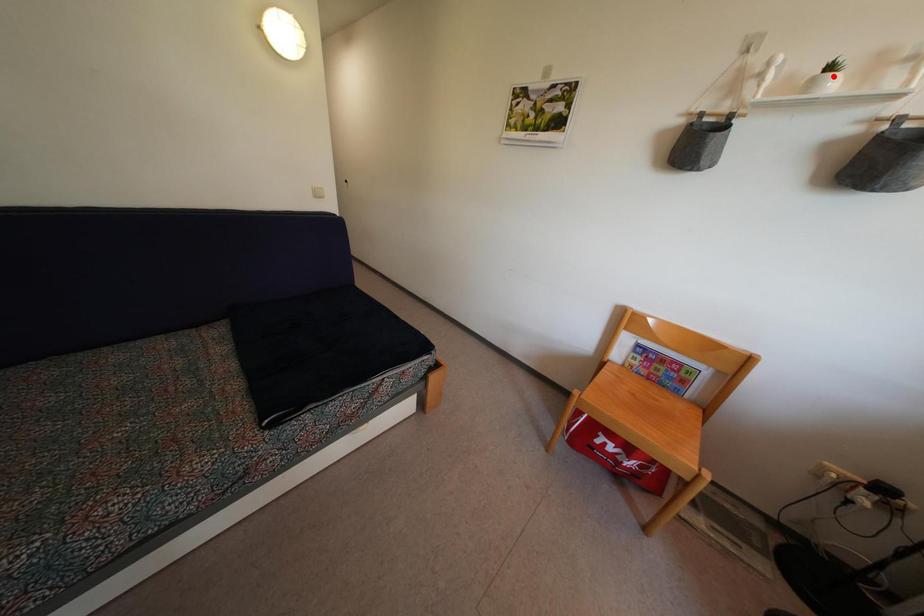
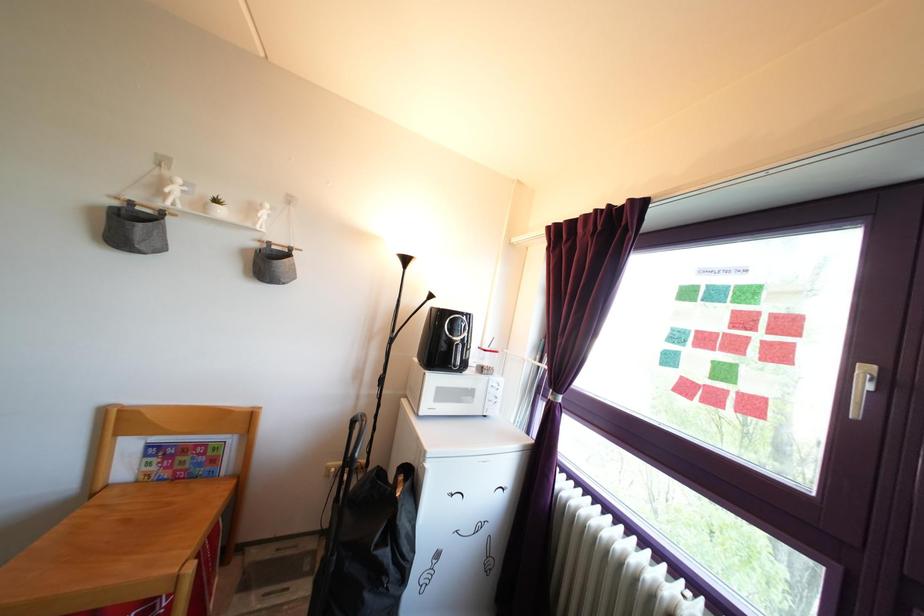
Question: I am providing you with two images of the same scene from different viewpoints. Given a red point in image1, look at the same physical point in image2. Is it:

Choices:
 (A) Closer to the viewpoint
 (B) Farther from the viewpoint

Answer: (A)